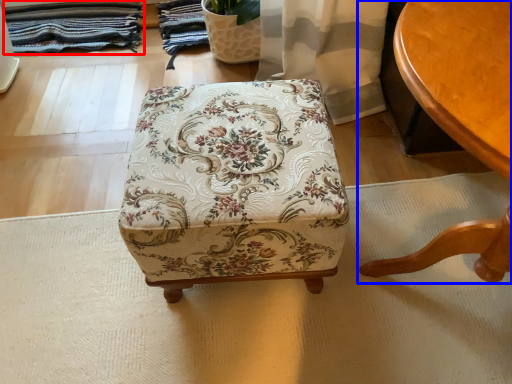
Question: Among these objects, which one is farthest to the camera, blanket (highlighted by a red box) or table (highlighted by a blue box)?

Choices:
 (A) blanket
 (B) table

Answer: (A)